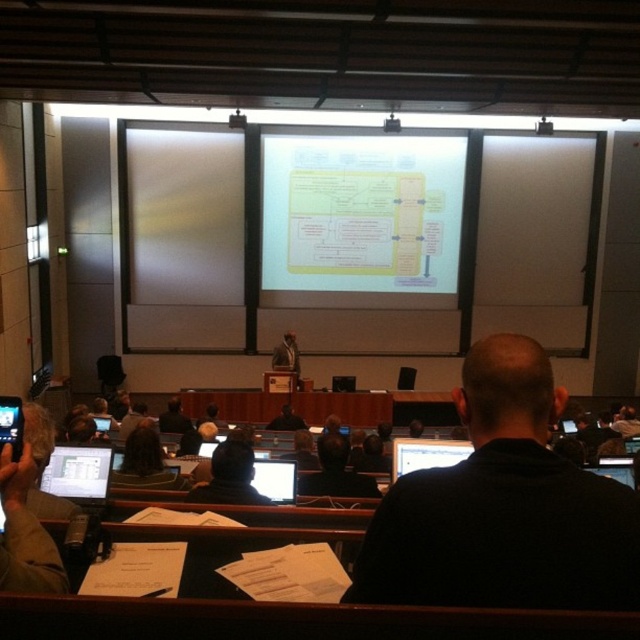
Question: Which point is farther from the camera taking this photo?

Choices:
 (A) (77, 512)
 (B) (234, 449)

Answer: (B)

Question: Which point is closer to the camera taking this photo?

Choices:
 (A) (307, 177)
 (B) (65, 518)

Answer: (B)

Question: Can you confirm if black shirt at center is positioned below matte black laptop at lower left?

Choices:
 (A) no
 (B) yes

Answer: (A)

Question: Among these objects, which one is nearest to the camera?

Choices:
 (A) black fabric at center
 (B) gray fabric laptop at lower left

Answer: (B)

Question: Can you confirm if matte black laptop at lower left is bigger than gray fabric laptop at lower left?

Choices:
 (A) yes
 (B) no

Answer: (B)

Question: Is dark blue shirt at center positioned at the back of gray fabric laptop at lower left?

Choices:
 (A) no
 (B) yes

Answer: (B)